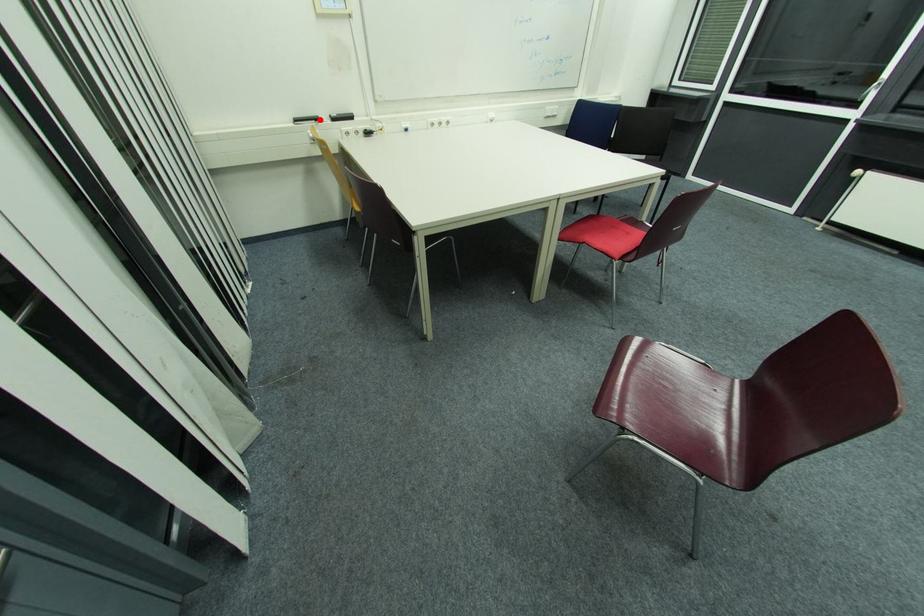
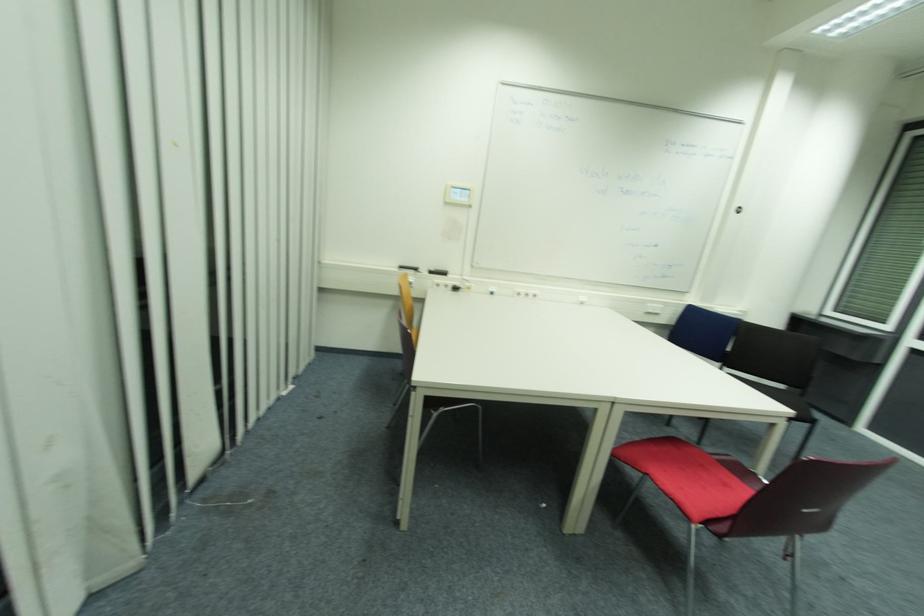
Question: I am providing you with two images of the same scene from different viewpoints. Given a red point in image1, look at the same physical point in image2. Is it:

Choices:
 (A) Closer to the viewpoint
 (B) Farther from the viewpoint

Answer: (B)